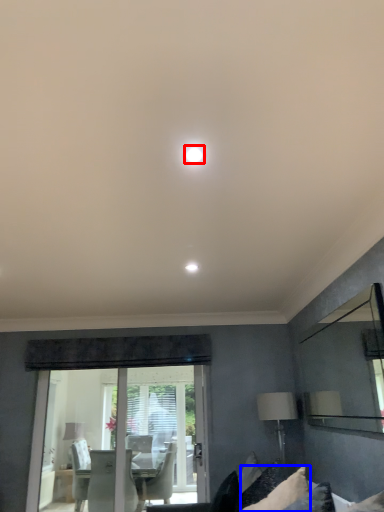
Question: Which of the following is the closest to the observer, lighting (highlighted by a red box) or pillow (highlighted by a blue box)?

Choices:
 (A) lighting
 (B) pillow

Answer: (A)